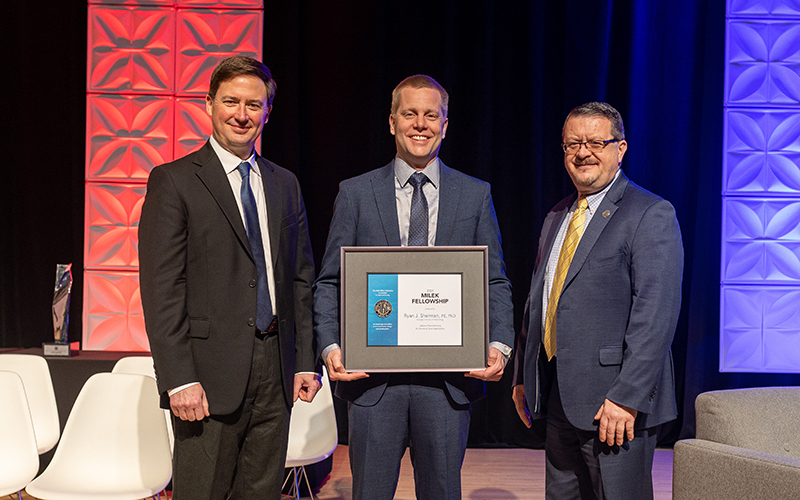
Image resolution: width=800 pixels, height=500 pixels. I want to click on award plaque, so click(406, 288), click(424, 355), click(357, 315), click(472, 312).